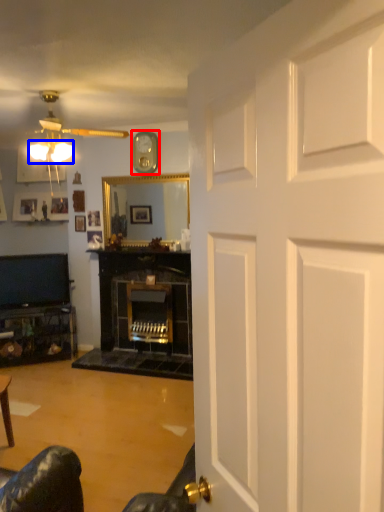
Question: Which of the following is the closest to the observer, clock (highlighted by a red box) or lamp (highlighted by a blue box)?

Choices:
 (A) clock
 (B) lamp

Answer: (B)